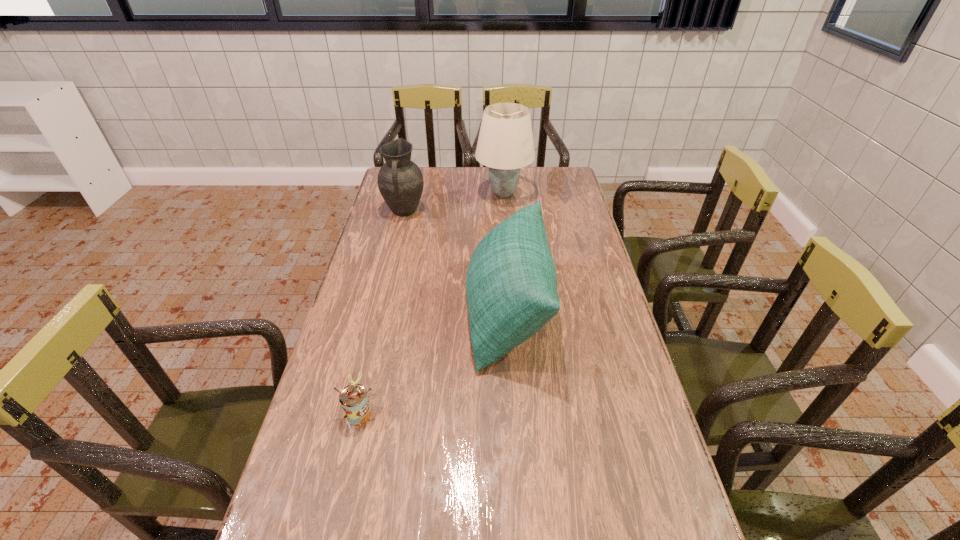
Identify the location of lampshade. The height and width of the screenshot is (540, 960). (505, 144).

You are a GUI agent. You are given a task and a screenshot of the screen. Output one action in this format:
    pyautogui.click(x=<x>, y=<y>)
    Task: Click on the pitcher
    This screenshot has width=960, height=540.
    Given the screenshot: What is the action you would take?
    pyautogui.click(x=400, y=181)

I want to click on the second nearest object, so click(x=511, y=284).

Identify the location of the nearest object. (353, 398).

At what (x,y) coordinates should I click in order to perform the action: click on can. Please return your answer as a coordinate pair (x, y). Image resolution: width=960 pixels, height=540 pixels. Looking at the image, I should click on (353, 398).

In order to click on vacant position located on the right of the lampshade in this screenshot , I will do `click(563, 194)`.

This screenshot has width=960, height=540. What are the coordinates of `free space located on the side of the pitcher with the handle` in the screenshot? It's located at (397, 240).

Locate an element on the screen. This screenshot has width=960, height=540. free space located on the front-facing side of the cushion is located at coordinates (348, 312).

Identify the location of vacant space positioned on the front-facing side of the cushion. (364, 312).

Where is `free space located on the front-facing side of the cushion`? The width and height of the screenshot is (960, 540). free space located on the front-facing side of the cushion is located at coordinates (446, 312).